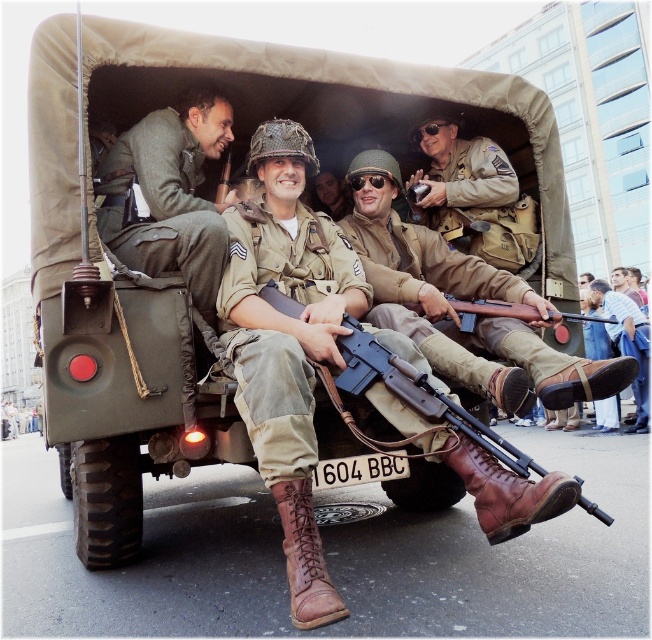
Who is positioned more to the left, tan leather boots at center or khaki uniform at center?

Positioned to the left is tan leather boots at center.

Between tan leather boots at center and khaki uniform at center, which one is positioned higher?

Positioned higher is khaki uniform at center.

What do you see at coordinates (460, 298) in the screenshot? The height and width of the screenshot is (640, 652). I see `tan leather boots at center` at bounding box center [460, 298].

At what (x,y) coordinates should I click in order to perform the action: click on tan leather boots at center. Please return your answer as a coordinate pair (x, y). The width and height of the screenshot is (652, 640). Looking at the image, I should click on (460, 298).

Can you confirm if matte brown leather boots at center is positioned below tan leather boots at center?

Yes.

Between matte brown leather boots at center and tan leather boots at center, which one appears on the left side from the viewer's perspective?

matte brown leather boots at center

Describe the element at coordinates (288, 342) in the screenshot. The width and height of the screenshot is (652, 640). I see `matte brown leather boots at center` at that location.

At what (x,y) coordinates should I click in order to perform the action: click on matte brown leather boots at center. Please return your answer as a coordinate pair (x, y). Looking at the image, I should click on (288, 342).

Which of these two, tan leather boots at center or matte green uniform at center, stands taller?

Standing taller between the two is tan leather boots at center.

The image size is (652, 640). Describe the element at coordinates (460, 298) in the screenshot. I see `tan leather boots at center` at that location.

Where is `tan leather boots at center`? The image size is (652, 640). tan leather boots at center is located at coordinates (460, 298).